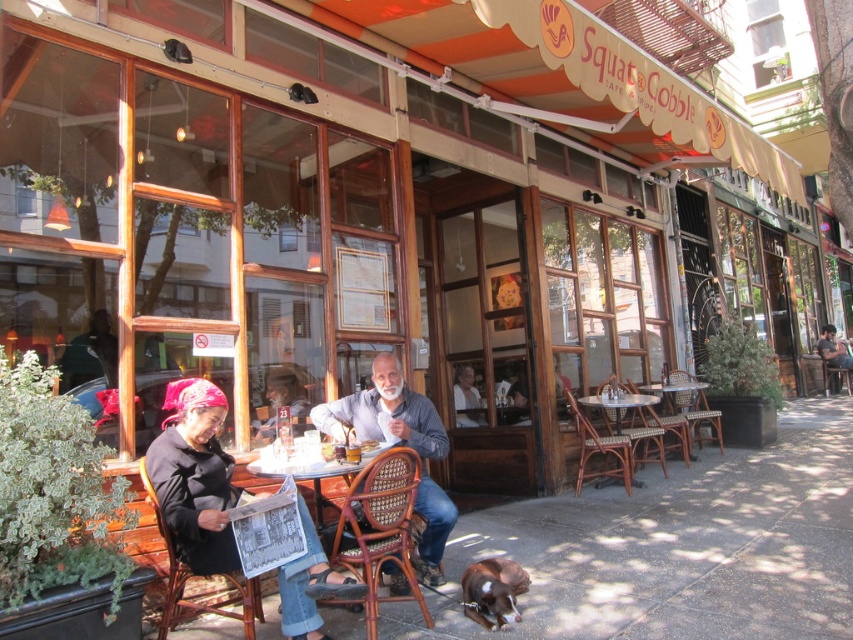
You are standing at the entrance of the Squat and Cobble cafe and want to greet the person wearing the blue denim shirt at center. In which direction should you walk relative to the entrance?

The blue denim shirt at center is located at point (398, 444). Since the entrance is at the corner of the building, you should walk towards the center of the image to reach the blue denim shirt at center.

You are standing at the point labeled point (288, 472) and want to move to the entrance of the Squat amp amp Cobble cafe. If you walk straight ahead, will you pass by the point labeled point (430, 513) before reaching the entrance?

Since point (430, 513) is behind point (288, 472), walking straight ahead towards the entrance would mean you would reach the entrance before passing by point (430, 513).